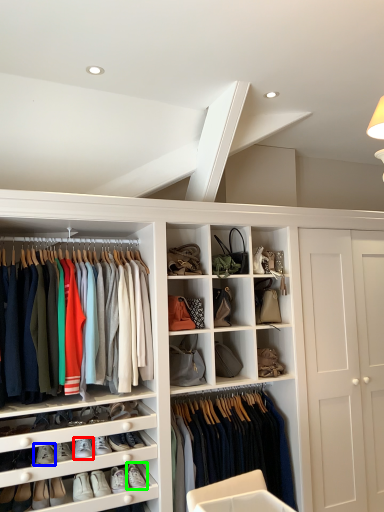
Question: Based on their relative distances, which object is nearer to footwear (highlighted by a red box)? Choose from footwear (highlighted by a blue box) and footwear (highlighted by a green box).

Choices:
 (A) footwear
 (B) footwear

Answer: (A)